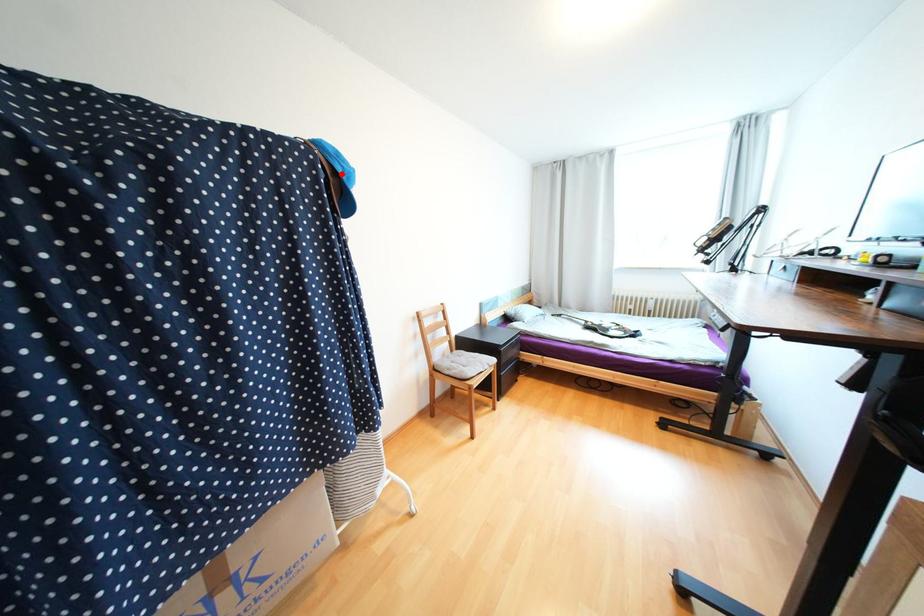
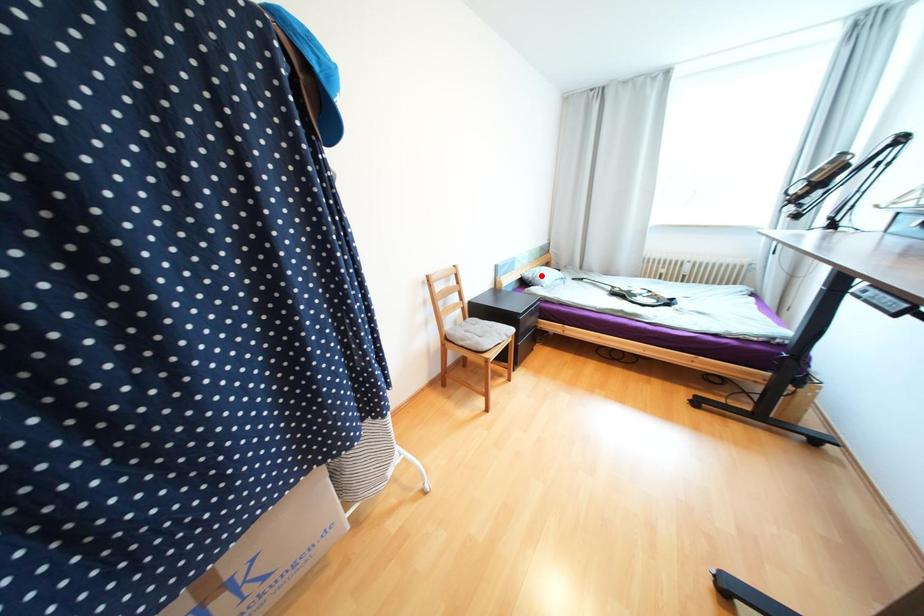
I am providing you with two images of the same scene from different viewpoints. A red point is marked on the first image and another point is marked on the second image. Are the points marked in image1 and image2 representing the same 3D position?

No